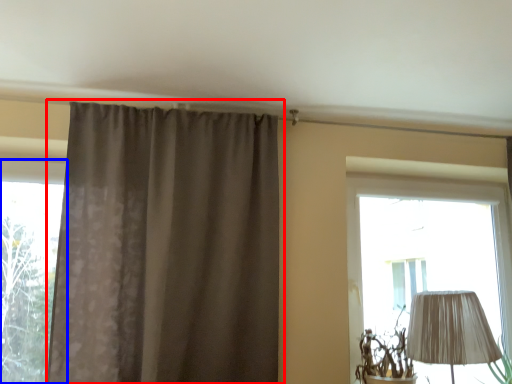
Question: Which object is closer to the camera taking this photo, curtain (highlighted by a red box) or window (highlighted by a blue box)?

Choices:
 (A) curtain
 (B) window

Answer: (A)